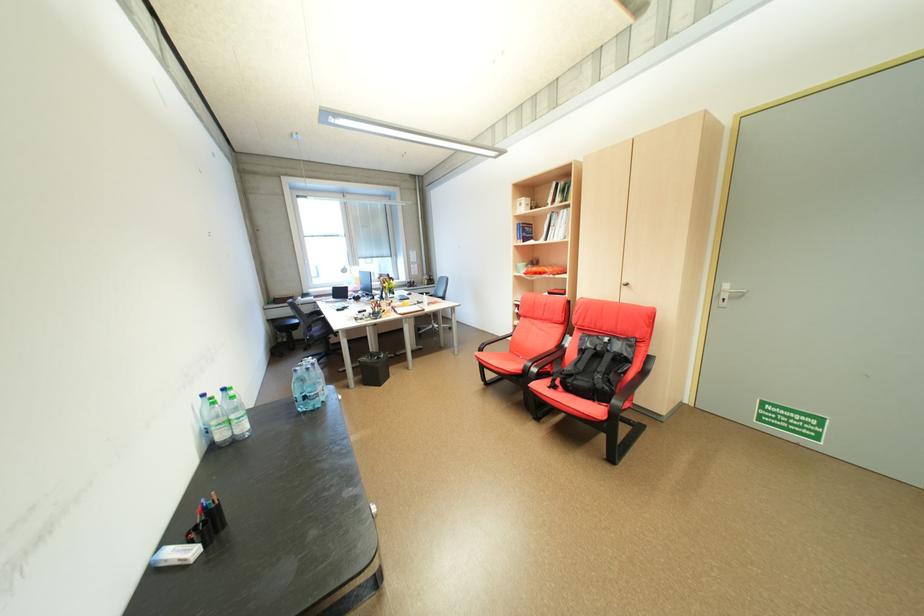
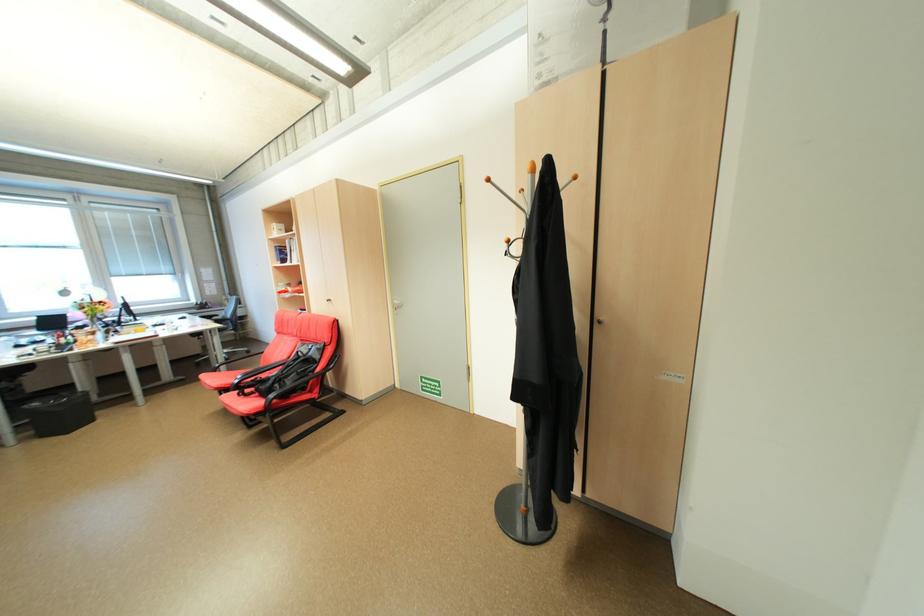
Find the pixel in the second image that matches pixel 458 329 in the first image.

(257, 353)